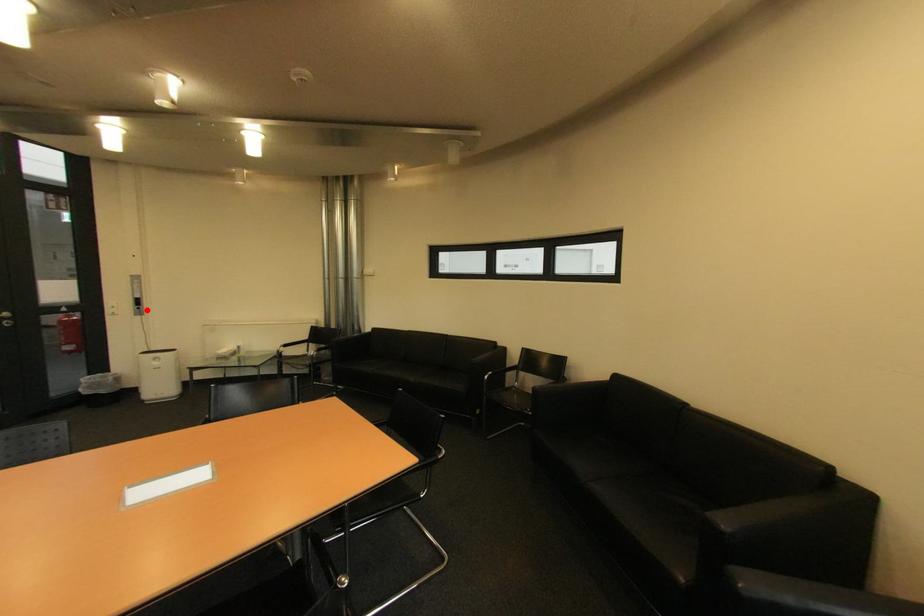
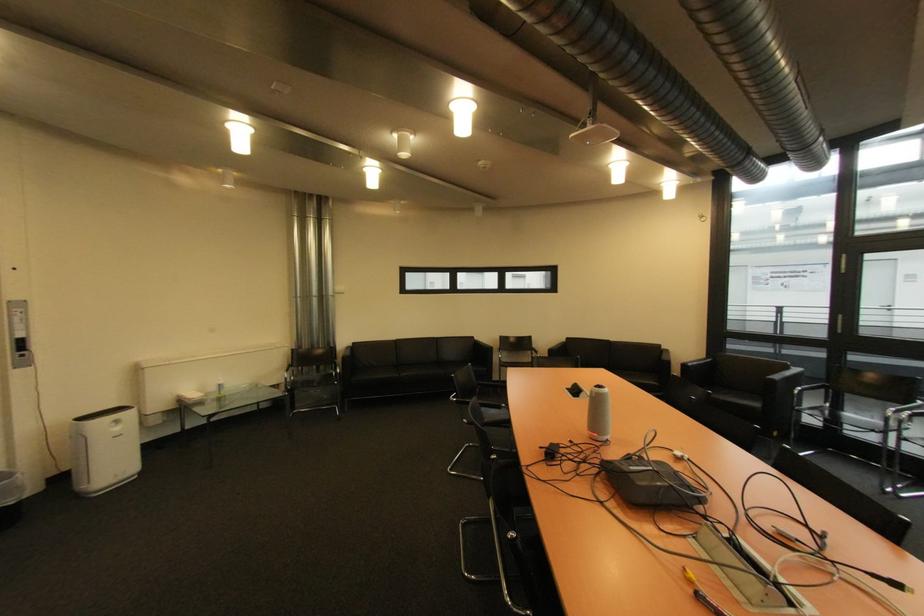
The point at the highlighted location is marked in the first image. Where is the corresponding point in the second image?

(30, 357)